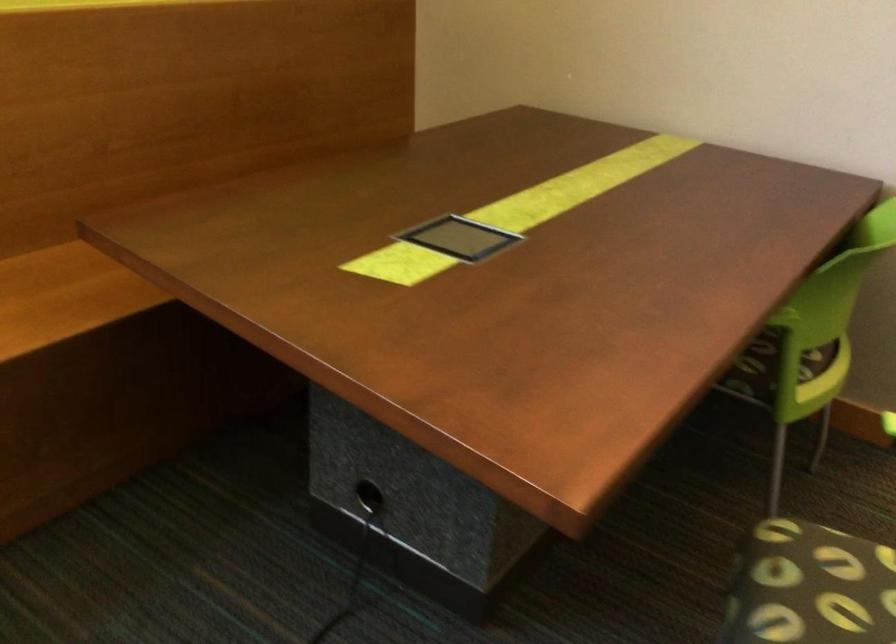
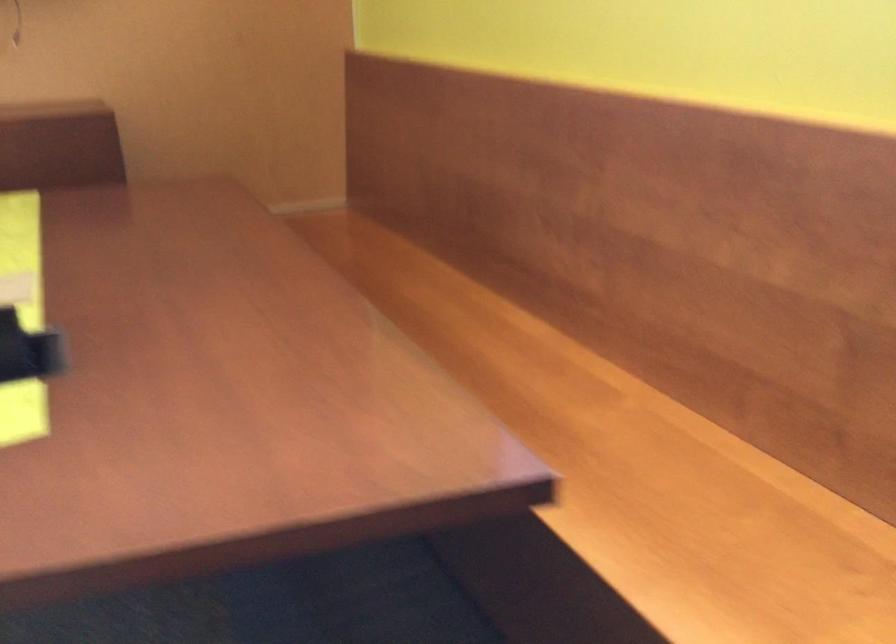
How did the camera likely rotate?

The camera's rotation is toward left-down.